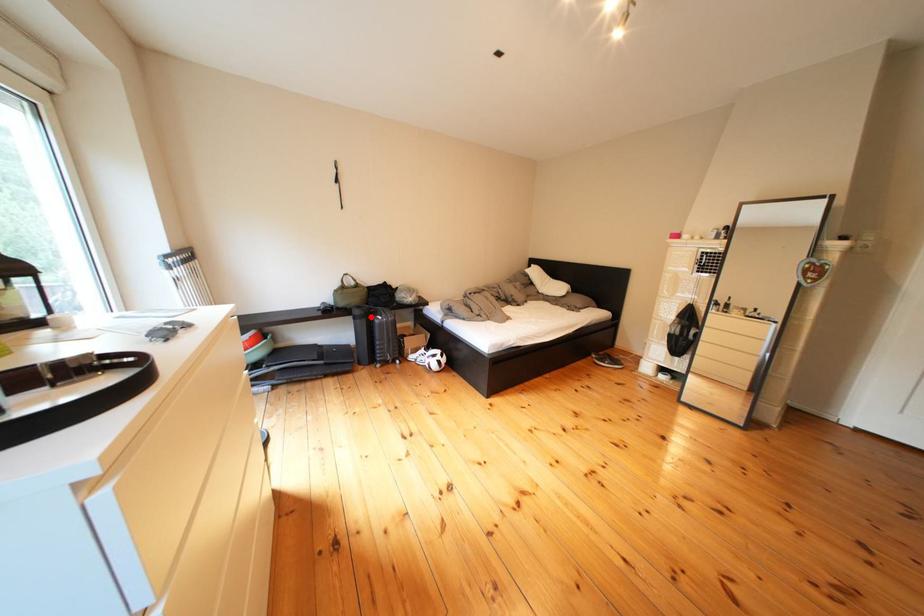
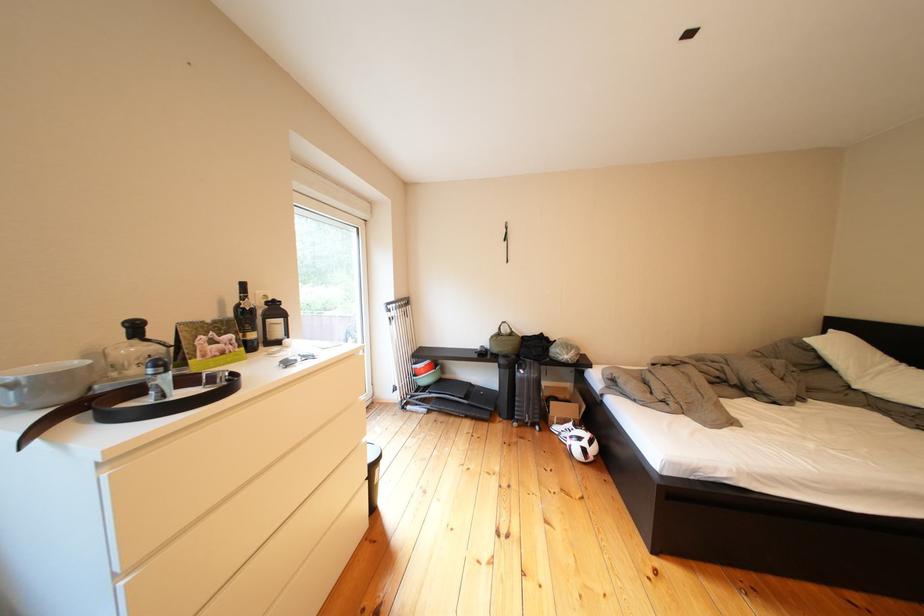
Question: I am providing you with two images of the same scene from different viewpoints. Image1 has a red point marked. In image2, the corresponding 3D location appears at what relative position? Reply with the corresponding letter.

Choices:
 (A) Closer
 (B) Farther

Answer: (B)